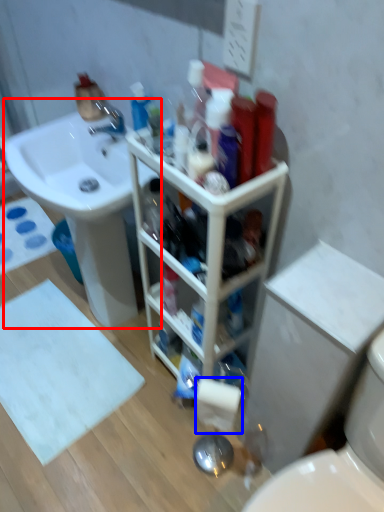
Question: Which of the following is the farthest to the observer, sink (highlighted by a red box) or toilet paper (highlighted by a blue box)?

Choices:
 (A) sink
 (B) toilet paper

Answer: (A)